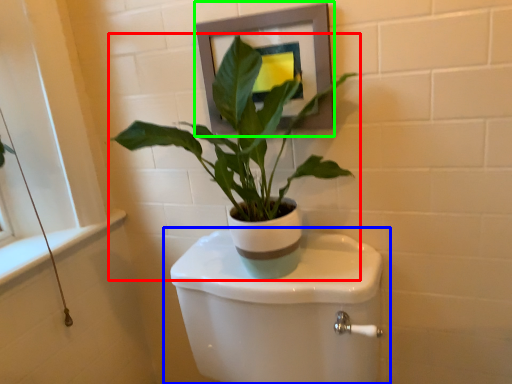
Question: Which object is positioned farthest from houseplant (highlighted by a red box)? Select from toilet (highlighted by a blue box) and picture frame (highlighted by a green box).

Choices:
 (A) toilet
 (B) picture frame

Answer: (A)